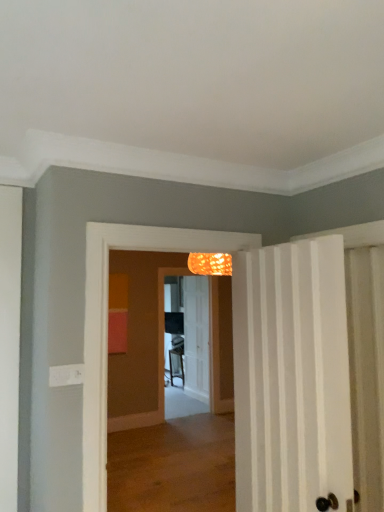
Question: Is point (190, 361) positioned closer to the camera than point (271, 250)?

Choices:
 (A) closer
 (B) farther

Answer: (B)

Question: In terms of size, does translucent glass screen door at center appear bigger or smaller than white striped door at right, the 2th door in the back-to-front sequence?

Choices:
 (A) small
 (B) big

Answer: (A)

Question: Which is farther from the translucent glass screen door at center?

Choices:
 (A) white textured door at center, the first door in the back-to-front sequence
 (B) white striped door at right, the 2th door in the back-to-front sequence

Answer: (B)

Question: Estimate the real-world distances between objects in this image. Which object is farther from the white striped door at right, the 2th door in the back-to-front sequence?

Choices:
 (A) white textured door at center, which is counted as the second door, starting from the front
 (B) translucent glass screen door at center

Answer: (A)